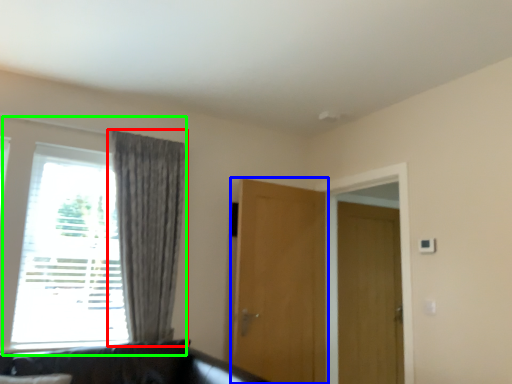
Question: Which object is the farthest from curtain (highlighted by a red box)? Choose among these: door (highlighted by a blue box) or window (highlighted by a green box).

Choices:
 (A) door
 (B) window

Answer: (A)